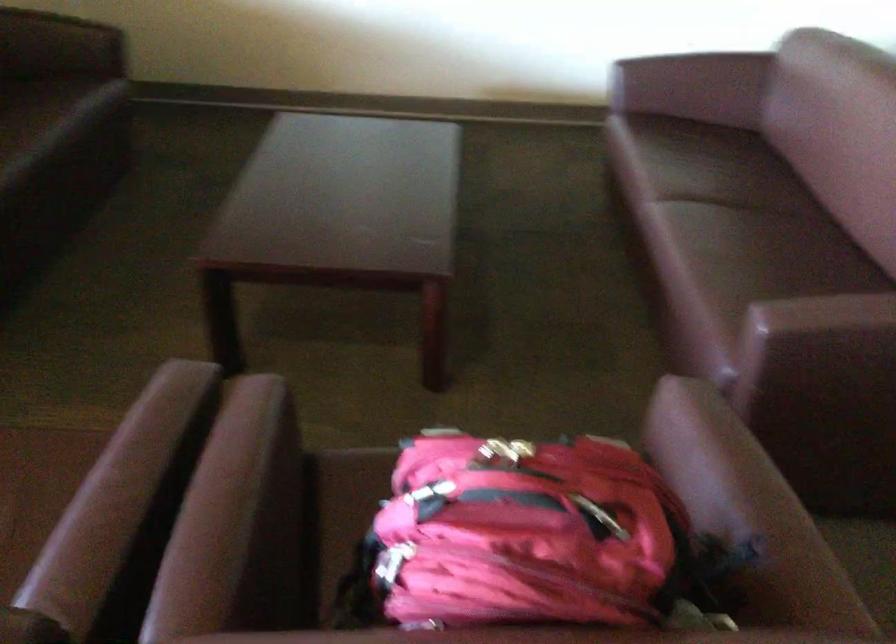
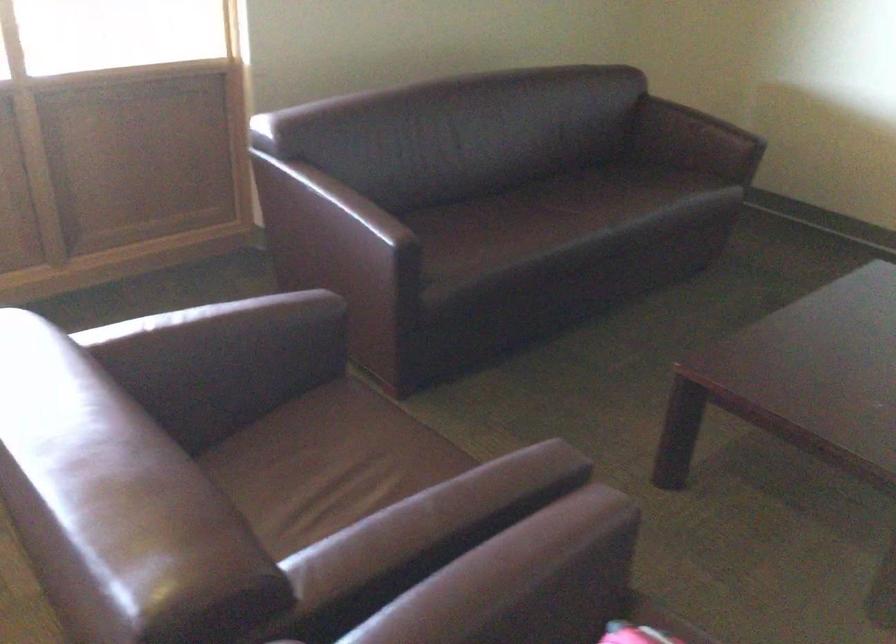
Find the pixel in the second image that matches [420,351] in the first image.

(883, 569)